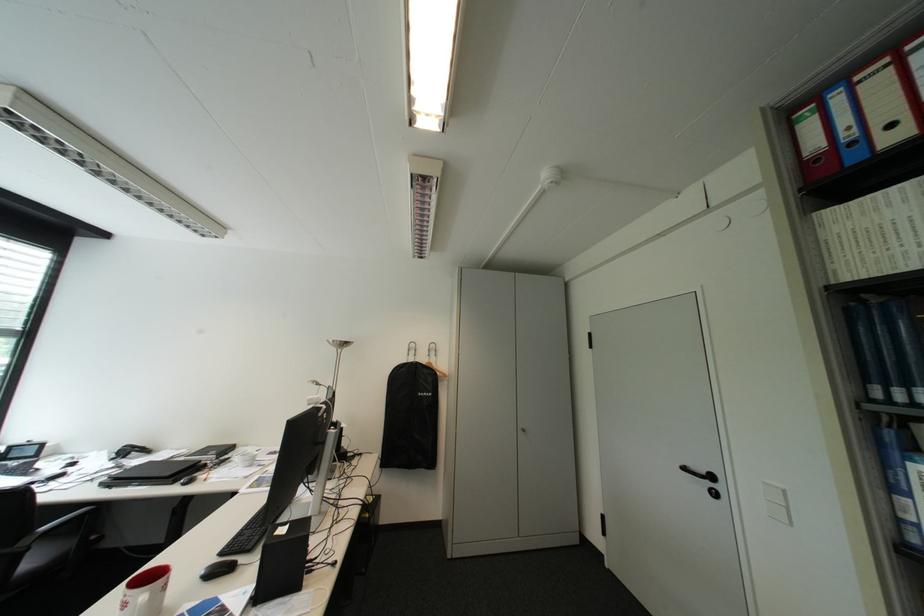
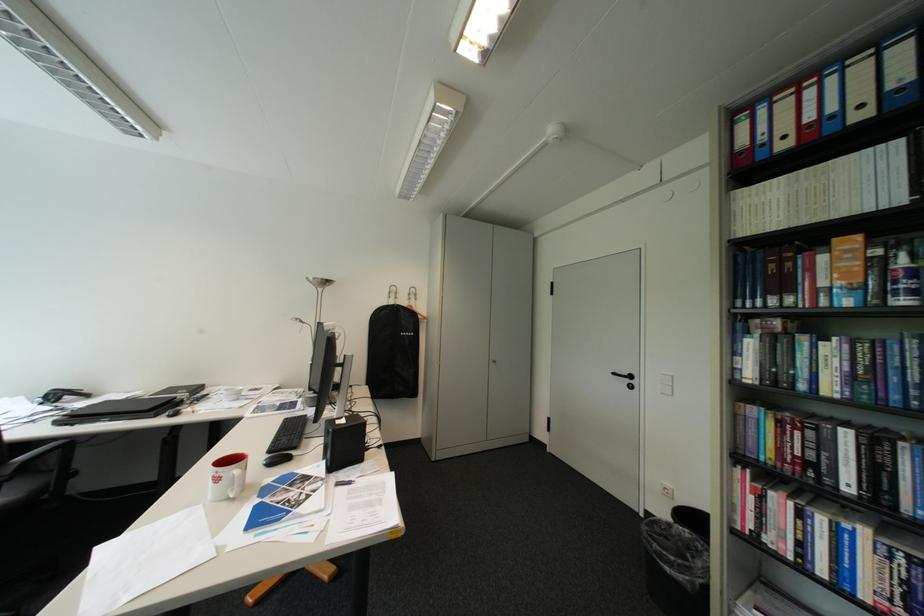
Question: The first image is from the beginning of the video and the second image is from the end. How did the camera likely rotate when shooting the video?

Choices:
 (A) Left
 (B) Right
 (C) Up
 (D) Down

Answer: (B)